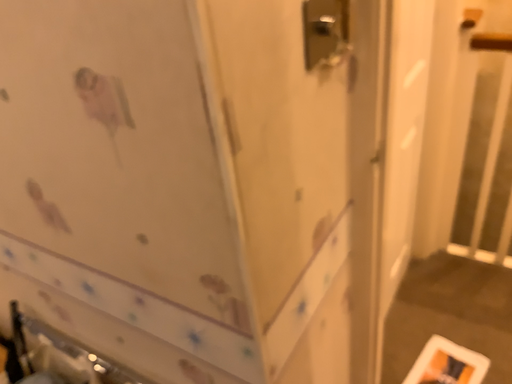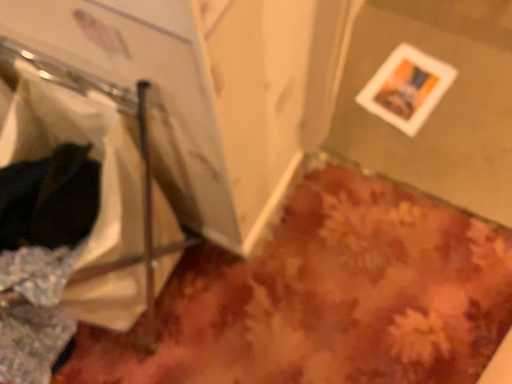
Question: Which way did the camera rotate in the video?

Choices:
 (A) rotated upward
 (B) rotated downward

Answer: (B)